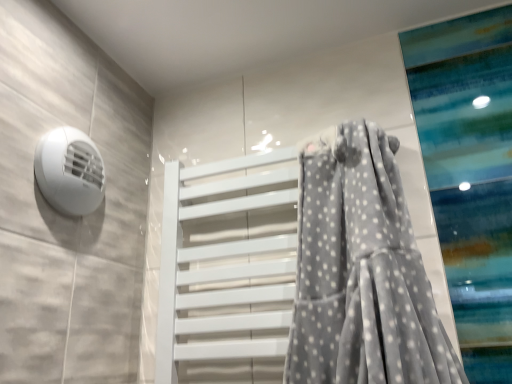
The height and width of the screenshot is (384, 512). I want to click on gray polka dot fabric at center, so click(361, 271).

What do you see at coordinates (361, 271) in the screenshot? The image size is (512, 384). I see `gray polka dot fabric at center` at bounding box center [361, 271].

Where is `gray polka dot fabric at center`? This screenshot has height=384, width=512. gray polka dot fabric at center is located at coordinates (361, 271).